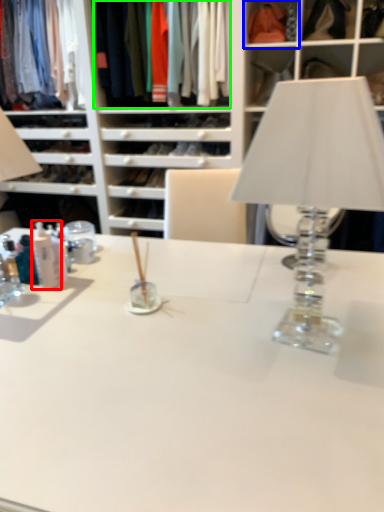
Question: Which object is the closest to the toiletry (highlighted by a red box)? Choose among these: cabinet (highlighted by a blue box) or clothing (highlighted by a green box).

Choices:
 (A) cabinet
 (B) clothing

Answer: (B)